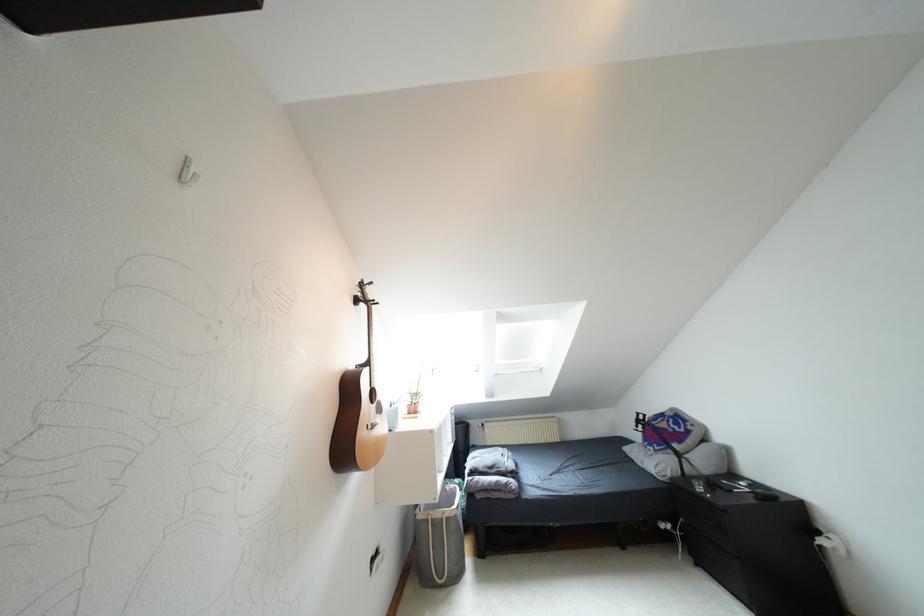
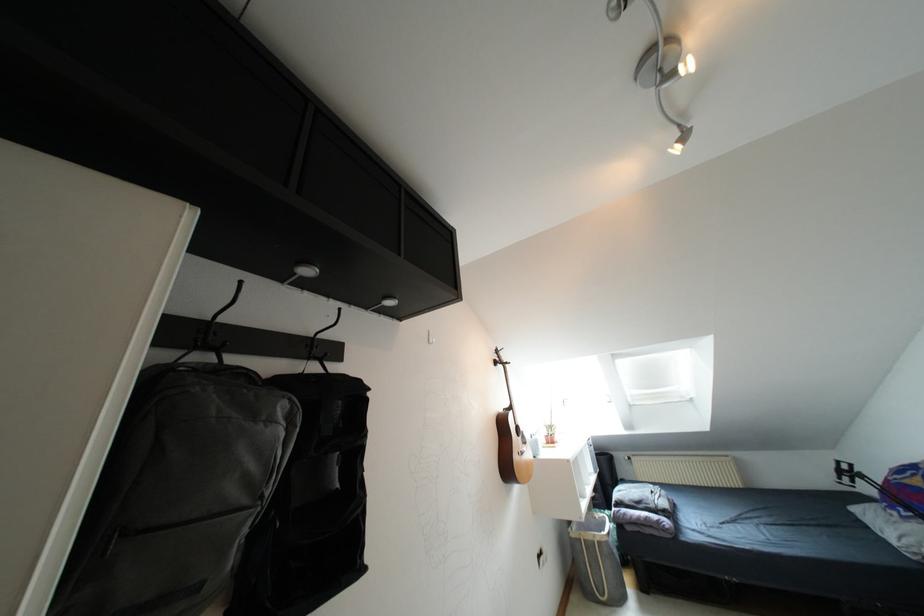
Find the pixel in the second image that matches the point at 412,410 in the first image.

(550, 440)